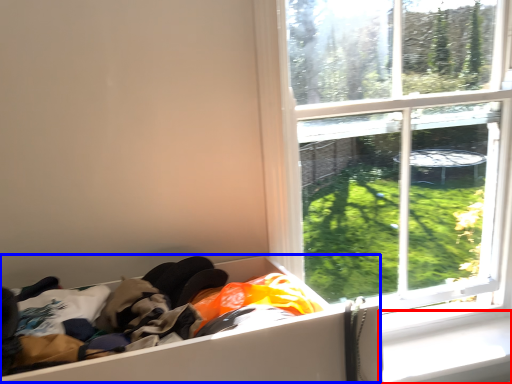
Question: Among these objects, which one is nearest to the camera, window sill (highlighted by a red box) or storage box (highlighted by a blue box)?

Choices:
 (A) window sill
 (B) storage box

Answer: (B)